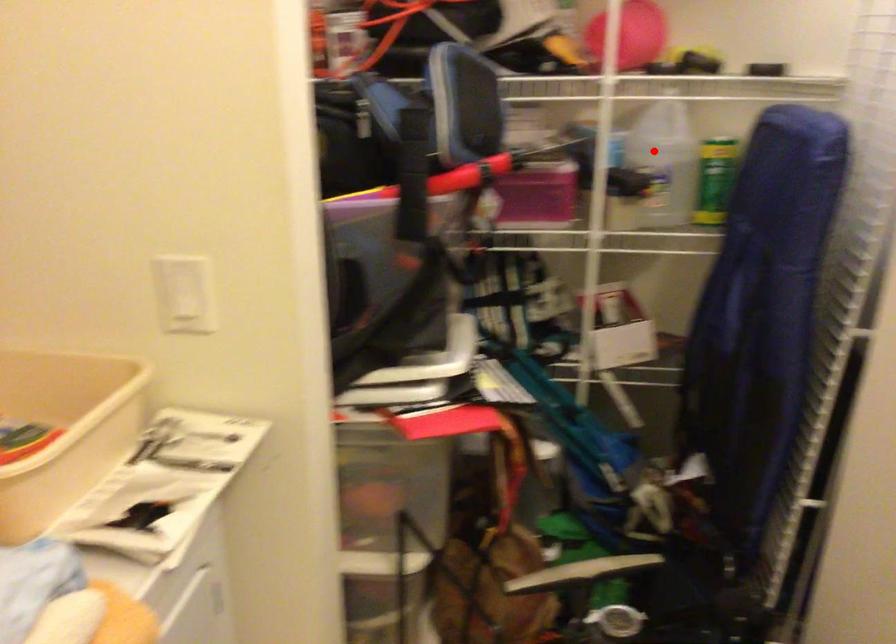
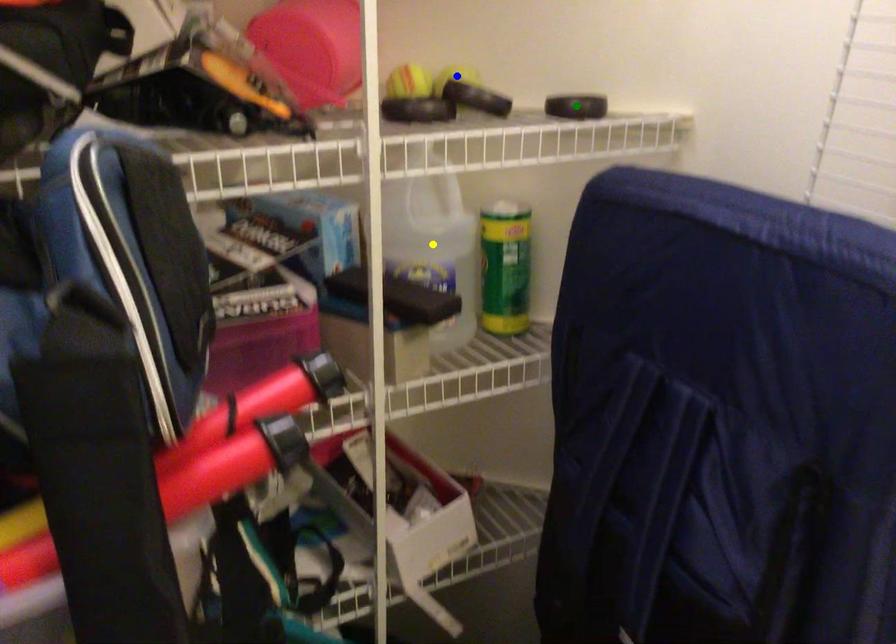
Question: I am providing you with two images of the same scene from different viewpoints. A red point is marked on the first image. You are given multiple points on the second image. In image 2, which mark is for the same physical point as the one in image 1?

Choices:
 (A) blue point
 (B) green point
 (C) yellow point

Answer: (C)